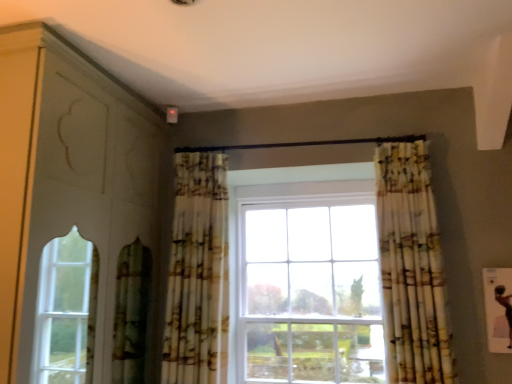
Question: Is printed fabric curtain at center, which is the 2th curtain from right to left, located within matte white dresser at left?

Choices:
 (A) yes
 (B) no

Answer: (B)

Question: Does matte white dresser at left have a greater height compared to printed fabric curtain at center, which is the 2th curtain from right to left?

Choices:
 (A) no
 (B) yes

Answer: (B)

Question: From the image's perspective, is matte white dresser at left located beneath printed fabric curtain at center, which is the 2th curtain from right to left?

Choices:
 (A) no
 (B) yes

Answer: (A)

Question: Is matte white dresser at left facing away from printed fabric curtain at center, which is the 2th curtain from right to left?

Choices:
 (A) no
 (B) yes

Answer: (A)

Question: Does matte white dresser at left appear on the left side of printed fabric curtain at center, which is the 2th curtain from right to left?

Choices:
 (A) yes
 (B) no

Answer: (A)

Question: Does matte white dresser at left turn towards printed fabric curtain at center, placed as the first curtain when sorted from left to right?

Choices:
 (A) yes
 (B) no

Answer: (A)

Question: Is the depth of printed fabric curtain at center, placed as the first curtain when sorted from left to right, greater than that of matte white dresser at left?

Choices:
 (A) yes
 (B) no

Answer: (A)

Question: From a real-world perspective, is printed fabric curtain at center, placed as the first curtain when sorted from left to right, below matte white dresser at left?

Choices:
 (A) yes
 (B) no

Answer: (A)

Question: Considering the relative sizes of printed fabric curtain at center, placed as the first curtain when sorted from left to right, and matte white dresser at left in the image provided, is printed fabric curtain at center, placed as the first curtain when sorted from left to right, shorter than matte white dresser at left?

Choices:
 (A) yes
 (B) no

Answer: (A)

Question: Can you confirm if printed fabric curtain at center, which is the 2th curtain from right to left, is thinner than matte white dresser at left?

Choices:
 (A) yes
 (B) no

Answer: (A)

Question: From the image's perspective, is printed fabric curtain at center, which is the 2th curtain from right to left, above matte white dresser at left?

Choices:
 (A) yes
 (B) no

Answer: (B)

Question: Does printed fabric curtain at center, which is the 2th curtain from right to left, appear on the left side of matte white dresser at left?

Choices:
 (A) yes
 (B) no

Answer: (B)

Question: Is printed fabric curtain at center, which is the 2th curtain from right to left, smaller than printed fabric curtain at right, placed as the 1th curtain when sorted from right to left?

Choices:
 (A) yes
 (B) no

Answer: (B)